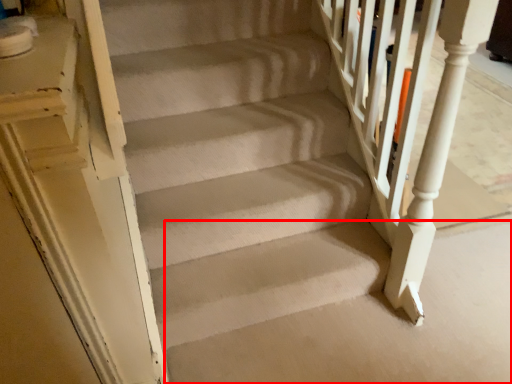
Question: Observing the image, what is the correct spatial positioning of concrete (annotated by the red box) in reference to rail?

Choices:
 (A) right
 (B) left

Answer: (B)